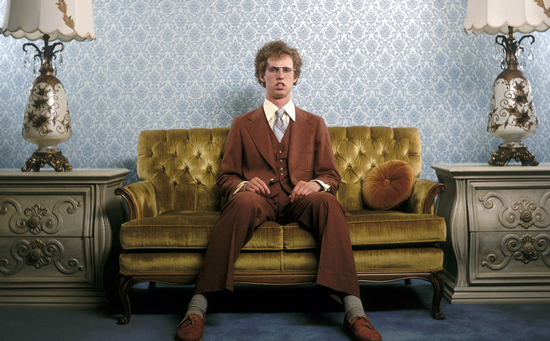
The image size is (550, 341). Find the location of `blue pattern wallpaper`. blue pattern wallpaper is located at coordinates (223, 7), (119, 122).